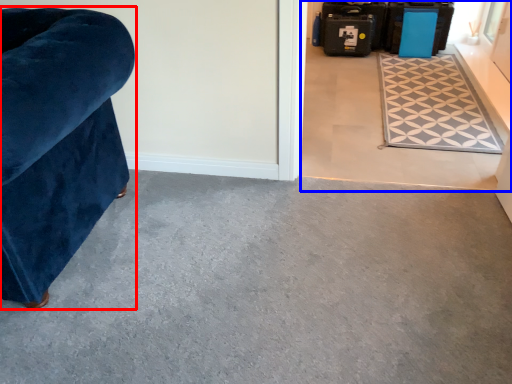
Question: Which of the following is the farthest to the observer, furniture (highlighted by a red box) or concrete (highlighted by a blue box)?

Choices:
 (A) furniture
 (B) concrete

Answer: (B)